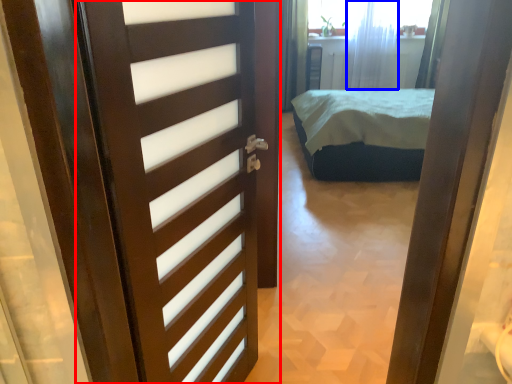
Question: Which of the following is the farthest to the observer, door (highlighted by a red box) or curtain (highlighted by a blue box)?

Choices:
 (A) door
 (B) curtain

Answer: (B)